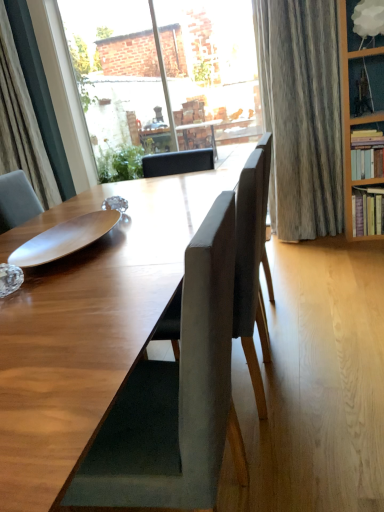
Question: Is white cloud lampshade at upper right, marked as the 3th shelf in a bottom-to-top arrangement, wider than hardcover books at right, the 1th shelf from the bottom?

Choices:
 (A) yes
 (B) no

Answer: (B)

Question: Is hardcover books at right, which is the 3th shelf in top-to-bottom order, inside white cloud lampshade at upper right, marked as the 3th shelf in a bottom-to-top arrangement?

Choices:
 (A) no
 (B) yes

Answer: (A)

Question: Considering the relative sizes of white cloud lampshade at upper right, marked as the 3th shelf in a bottom-to-top arrangement, and hardcover books at right, which is the 3th shelf in top-to-bottom order, in the image provided, is white cloud lampshade at upper right, marked as the 3th shelf in a bottom-to-top arrangement, bigger than hardcover books at right, which is the 3th shelf in top-to-bottom order,?

Choices:
 (A) no
 (B) yes

Answer: (A)

Question: Can you confirm if white cloud lampshade at upper right, marked as the 3th shelf in a bottom-to-top arrangement, is positioned to the right of hardcover books at right, which is the 3th shelf in top-to-bottom order?

Choices:
 (A) yes
 (B) no

Answer: (B)

Question: From the image's perspective, is white cloud lampshade at upper right, which is the first shelf from top to bottom, under hardcover books at right, the 1th shelf from the bottom?

Choices:
 (A) yes
 (B) no

Answer: (B)

Question: Do you think white cloud lampshade at upper right, which is the first shelf from top to bottom, is within wooden plate at center, or outside of it?

Choices:
 (A) inside
 (B) outside

Answer: (B)

Question: Considering the positions of white cloud lampshade at upper right, which is the first shelf from top to bottom, and wooden plate at center in the image, is white cloud lampshade at upper right, which is the first shelf from top to bottom, bigger or smaller than wooden plate at center?

Choices:
 (A) big
 (B) small

Answer: (A)

Question: From a real-world perspective, is white cloud lampshade at upper right, which is the first shelf from top to bottom, positioned above or below wooden plate at center?

Choices:
 (A) below
 (B) above

Answer: (B)

Question: Considering the positions of point (382, 45) and point (64, 240), is point (382, 45) closer or farther from the camera than point (64, 240)?

Choices:
 (A) closer
 (B) farther

Answer: (B)

Question: From a real-world perspective, is white cloud lampshade at upper right, which is the first shelf from top to bottom, physically located above or below suede-like gray chair at center, marked as the 1th chair in a back-to-front arrangement?

Choices:
 (A) above
 (B) below

Answer: (A)

Question: Considering the positions of point (347, 31) and point (246, 232), is point (347, 31) closer or farther from the camera than point (246, 232)?

Choices:
 (A) farther
 (B) closer

Answer: (A)

Question: Based on their positions, is white cloud lampshade at upper right, marked as the 3th shelf in a bottom-to-top arrangement, located to the left or right of suede-like gray chair at center, which ranks as the second chair in front-to-back order?

Choices:
 (A) right
 (B) left

Answer: (A)

Question: In terms of width, does white cloud lampshade at upper right, which is the first shelf from top to bottom, look wider or thinner when compared to suede-like gray chair at center, which ranks as the second chair in front-to-back order?

Choices:
 (A) wide
 (B) thin

Answer: (B)

Question: Would you say hardcover books at right, which is the 3th shelf in top-to-bottom order, is inside or outside suede-like gray chair at center, marked as the 1th chair in a back-to-front arrangement?

Choices:
 (A) inside
 (B) outside

Answer: (B)

Question: Considering the positions of point (382, 230) and point (254, 313), is point (382, 230) closer or farther from the camera than point (254, 313)?

Choices:
 (A) closer
 (B) farther

Answer: (B)